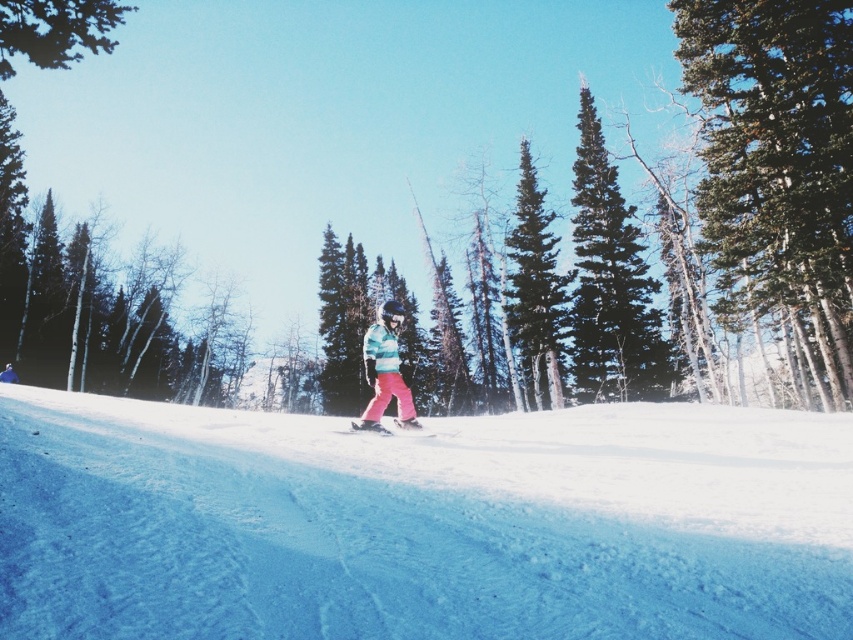
You are planning to take a photo of the striped fleece jacket at center and the green leafy tree at upper left. Which object should you focus on first if you want to capture both in a single frame without moving the camera?

The green leafy tree at upper left is much taller than the striped fleece jacket at center, so you should focus on the tree first to ensure it fits within the frame, then adjust for the jacket.

You are standing at the bottom of the slope and want to take a photo of the green leafy tree at upper left and the striped fleece jacket at center. Which object should you zoom in more on to ensure both are clearly visible in the photo?

You should zoom in more on the striped fleece jacket at center because the green leafy tree at upper left is larger in size, so it will already occupy more space in the photo, while the striped fleece jacket at center needs more focus to be visible.